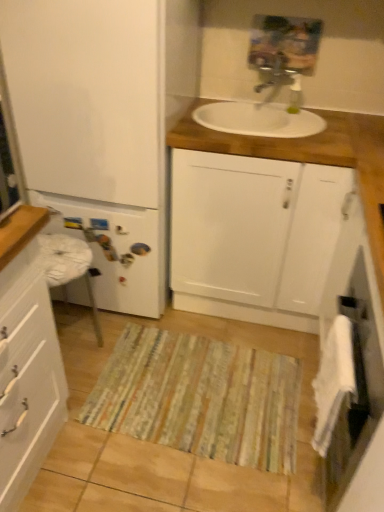
Question: Is white fabric towel at right at the right side of white soft towel at lower right?

Choices:
 (A) yes
 (B) no

Answer: (A)

Question: Considering the relative sizes of white fabric towel at right and white soft towel at lower right in the image provided, is white fabric towel at right smaller than white soft towel at lower right?

Choices:
 (A) yes
 (B) no

Answer: (B)

Question: From a real-world perspective, is white fabric towel at right physically below white soft towel at lower right?

Choices:
 (A) yes
 (B) no

Answer: (A)

Question: From the image's perspective, does white fabric towel at right appear lower than white soft towel at lower right?

Choices:
 (A) yes
 (B) no

Answer: (A)

Question: Are white fabric towel at right and white soft towel at lower right making contact?

Choices:
 (A) yes
 (B) no

Answer: (A)

Question: From the image's perspective, is white fabric towel at right on white soft towel at lower right?

Choices:
 (A) no
 (B) yes

Answer: (A)

Question: From the image's perspective, would you say white fabric towel at right is shown under white matte refrigerator at left, which is the 2th bathroom cabinet in left-to-right order?

Choices:
 (A) no
 (B) yes

Answer: (B)

Question: Considering the relative sizes of white fabric towel at right and white matte refrigerator at left, which is the second bathroom cabinet from right to left, in the image provided, is white fabric towel at right wider than white matte refrigerator at left, which is the second bathroom cabinet from right to left,?

Choices:
 (A) yes
 (B) no

Answer: (B)

Question: From the image's perspective, is white fabric towel at right on white matte refrigerator at left, which is the 2th bathroom cabinet in left-to-right order?

Choices:
 (A) no
 (B) yes

Answer: (A)

Question: Is white fabric towel at right not near white matte refrigerator at left, which is the second bathroom cabinet from right to left?

Choices:
 (A) no
 (B) yes

Answer: (B)

Question: Is the position of white fabric towel at right more distant than that of white matte refrigerator at left, which is the second bathroom cabinet from right to left?

Choices:
 (A) no
 (B) yes

Answer: (A)

Question: Is white fabric towel at right thinner than white matte refrigerator at left, which is the second bathroom cabinet from right to left?

Choices:
 (A) no
 (B) yes

Answer: (B)

Question: Is white soft towel at lower right oriented towards white matte refrigerator at left, which is the 2th bathroom cabinet in left-to-right order?

Choices:
 (A) yes
 (B) no

Answer: (B)